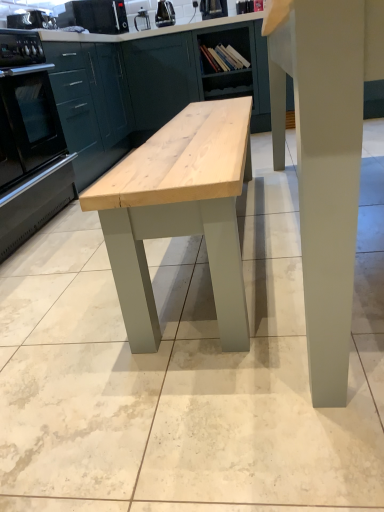
In order to click on matte green cabinetry at left, positioned as the 3th cabinetry in right-to-left order in this screenshot , I will do `click(89, 106)`.

I want to click on wooden bookshelf at center, arranged as the third cabinetry when viewed from the left, so click(228, 63).

This screenshot has height=512, width=384. I want to click on black plastic toaster at upper left, which appears as the 2th appliance when viewed from the left, so click(99, 15).

Consider the image. What is the approximate height of satin black oven at left?

It is 30.28 inches.

Find the location of a particular element. This screenshot has height=512, width=384. satin black oven at left is located at coordinates (29, 142).

Find the location of a particular element. smooth gray table at center is located at coordinates (325, 158).

How much distance is there between black plastic kettle at upper center, the 2th appliance positioned from the right, and wooden bookshelf at center, arranged as the third cabinetry when viewed from the left?

black plastic kettle at upper center, the 2th appliance positioned from the right, and wooden bookshelf at center, arranged as the third cabinetry when viewed from the left, are 29.68 inches apart.

Is black plastic kettle at upper center, positioned as the 3th appliance in left-to-right order, positioned with its back to wooden bookshelf at center, placed as the 1th cabinetry when sorted from right to left?

black plastic kettle at upper center, positioned as the 3th appliance in left-to-right order, does not have its back to wooden bookshelf at center, placed as the 1th cabinetry when sorted from right to left.

From the image's perspective, between black plastic kettle at upper center, the 2th appliance positioned from the right, and wooden bookshelf at center, arranged as the third cabinetry when viewed from the left, which one is located above?

black plastic kettle at upper center, the 2th appliance positioned from the right, appears higher in the image.

Can you confirm if black plastic kettle at upper center, positioned as the 3th appliance in left-to-right order, is thinner than wooden bookshelf at center, arranged as the third cabinetry when viewed from the left?

Yes, black plastic kettle at upper center, positioned as the 3th appliance in left-to-right order, is thinner than wooden bookshelf at center, arranged as the third cabinetry when viewed from the left.

Looking at this image, is matte green cabinetry at left, positioned as the 3th cabinetry in right-to-left order, taller than metallic silver toaster at upper center, marked as the 4th appliance in a left-to-right arrangement?

Yes.

Is matte green cabinetry at left, positioned as the 3th cabinetry in right-to-left order, thinner than metallic silver toaster at upper center, marked as the 4th appliance in a left-to-right arrangement?

In fact, matte green cabinetry at left, positioned as the 3th cabinetry in right-to-left order, might be wider than metallic silver toaster at upper center, marked as the 4th appliance in a left-to-right arrangement.

Is the position of matte green cabinetry at left, positioned as the 3th cabinetry in right-to-left order, more distant than that of metallic silver toaster at upper center, marked as the 4th appliance in a left-to-right arrangement?

No, matte green cabinetry at left, positioned as the 3th cabinetry in right-to-left order, is in front of metallic silver toaster at upper center, marked as the 4th appliance in a left-to-right arrangement.

Is matte green cabinetry at left, marked as the first cabinetry in a left-to-right arrangement, to the left or to the right of metallic silver toaster at upper center, marked as the 4th appliance in a left-to-right arrangement, in the image?

From the image, it's evident that matte green cabinetry at left, marked as the first cabinetry in a left-to-right arrangement, is to the left of metallic silver toaster at upper center, marked as the 4th appliance in a left-to-right arrangement.

Based on the photo, is black plastic kettle at upper center, positioned as the 3th appliance in left-to-right order, taller or shorter than smooth gray table at center?

black plastic kettle at upper center, positioned as the 3th appliance in left-to-right order, is shorter than smooth gray table at center.

In the scene shown: Is black plastic kettle at upper center, positioned as the 3th appliance in left-to-right order, thinner than smooth gray table at center?

Yes, black plastic kettle at upper center, positioned as the 3th appliance in left-to-right order, is thinner than smooth gray table at center.

From the image's perspective, is black plastic kettle at upper center, positioned as the 3th appliance in left-to-right order, over smooth gray table at center?

Indeed, from the image's perspective, black plastic kettle at upper center, positioned as the 3th appliance in left-to-right order, is shown above smooth gray table at center.

Which is farther from the camera, (167, 17) or (360, 160)?

Positioned behind is point (167, 17).

Which object is wider, metallic silver toaster at upper center, marked as the 4th appliance in a left-to-right arrangement, or black plastic toaster at upper left, positioned as the 4th appliance in right-to-left order?

With larger width is black plastic toaster at upper left, positioned as the 4th appliance in right-to-left order.

Between metallic silver toaster at upper center, the 1th appliance positioned from the right, and black plastic toaster at upper left, which ranks as the first appliance in left-to-right order, which one has smaller size?

Smaller between the two is metallic silver toaster at upper center, the 1th appliance positioned from the right.

Is black plastic toaster at upper left, which ranks as the first appliance in left-to-right order, a part of metallic silver toaster at upper center, the 1th appliance positioned from the right?

No, black plastic toaster at upper left, which ranks as the first appliance in left-to-right order, is not surrounded by metallic silver toaster at upper center, the 1th appliance positioned from the right.

From a real-world perspective, which object stands above the other?

black plastic toaster at upper left, positioned as the 4th appliance in right-to-left order, is physically above.

In the image, is satin black oven at left positioned in front of or behind black plastic toaster at upper left, which appears as the 2th appliance when viewed from the left?

satin black oven at left is in front of black plastic toaster at upper left, which appears as the 2th appliance when viewed from the left.

Between satin black oven at left and black plastic toaster at upper left, the third appliance in the right-to-left sequence, which one has more height?

With more height is satin black oven at left.

Is black plastic toaster at upper left, which appears as the 2th appliance when viewed from the left, not near black plastic toaster at upper left, which ranks as the first appliance in left-to-right order?

That's not correct — black plastic toaster at upper left, which appears as the 2th appliance when viewed from the left, is a little close to black plastic toaster at upper left, which ranks as the first appliance in left-to-right order.

Does black plastic toaster at upper left, the third appliance in the right-to-left sequence, turn towards black plastic toaster at upper left, positioned as the 4th appliance in right-to-left order?

No, black plastic toaster at upper left, the third appliance in the right-to-left sequence, does not turn towards black plastic toaster at upper left, positioned as the 4th appliance in right-to-left order.

From the image's perspective, starting from the black plastic toaster at upper left, which ranks as the first appliance in left-to-right order, which appliance is the 2nd one above? Please provide its 2D coordinates.

[(99, 15)]

Is black plastic toaster at upper left, which appears as the 2th appliance when viewed from the left, to the left or to the right of wooden bookshelf at center, arranged as the third cabinetry when viewed from the left, in the image?

black plastic toaster at upper left, which appears as the 2th appliance when viewed from the left, is positioned on wooden bookshelf at center, arranged as the third cabinetry when viewed from the left,'s left side.

Considering the sizes of objects black plastic toaster at upper left, which appears as the 2th appliance when viewed from the left, and wooden bookshelf at center, placed as the 1th cabinetry when sorted from right to left, in the image provided, who is smaller, black plastic toaster at upper left, which appears as the 2th appliance when viewed from the left, or wooden bookshelf at center, placed as the 1th cabinetry when sorted from right to left,?

black plastic toaster at upper left, which appears as the 2th appliance when viewed from the left, is smaller.

From the picture: Is black plastic toaster at upper left, the third appliance in the right-to-left sequence, taller than wooden bookshelf at center, arranged as the third cabinetry when viewed from the left?

In fact, black plastic toaster at upper left, the third appliance in the right-to-left sequence, may be shorter than wooden bookshelf at center, arranged as the third cabinetry when viewed from the left.

From the black plastic kettle at upper center, the 2th appliance positioned from the right, count 2nd cabinetry to the right and point to it. Please provide its 2D coordinates.

[(228, 63)]

This screenshot has height=512, width=384. I want to click on cabinetry that is the 1st one below the metallic silver toaster at upper center, marked as the 4th appliance in a left-to-right arrangement (from a real-world perspective), so click(x=89, y=106).

Based on their spatial positions, is matte green cabinetry at left, positioned as the 3th cabinetry in right-to-left order, or black plastic toaster at upper left, the third appliance in the right-to-left sequence, further from black plastic kettle at upper center, positioned as the 3th appliance in left-to-right order?

matte green cabinetry at left, positioned as the 3th cabinetry in right-to-left order.

From the image, which object appears to be farther from metallic silver toaster at upper center, the 1th appliance positioned from the right, smooth gray table at center or matte green cabinetry at left, marked as the first cabinetry in a left-to-right arrangement?

smooth gray table at center is positioned further to the anchor metallic silver toaster at upper center, the 1th appliance positioned from the right.

Estimate the real-world distances between objects in this image. Which object is further from black plastic toaster at upper left, positioned as the 4th appliance in right-to-left order, matte green cabinet at center, which is the 2th cabinetry in right-to-left order, or wooden bookshelf at center, arranged as the third cabinetry when viewed from the left?

wooden bookshelf at center, arranged as the third cabinetry when viewed from the left, is further to black plastic toaster at upper left, positioned as the 4th appliance in right-to-left order.

Which object lies further to the anchor point matte green cabinetry at left, positioned as the 3th cabinetry in right-to-left order, black plastic kettle at upper center, positioned as the 3th appliance in left-to-right order, or black plastic toaster at upper left, the third appliance in the right-to-left sequence?

black plastic kettle at upper center, positioned as the 3th appliance in left-to-right order, lies further to matte green cabinetry at left, positioned as the 3th cabinetry in right-to-left order, than the other object.

Looking at the image, which one is located further to satin black oven at left, matte green cabinetry at left, marked as the first cabinetry in a left-to-right arrangement, or black plastic kettle at upper center, positioned as the 3th appliance in left-to-right order?

The object further to satin black oven at left is black plastic kettle at upper center, positioned as the 3th appliance in left-to-right order.

Based on the photo, estimate the real-world distances between objects in this image. Which object is further from matte green cabinetry at left, marked as the first cabinetry in a left-to-right arrangement, black plastic toaster at upper left, the third appliance in the right-to-left sequence, or metallic silver toaster at upper center, the 1th appliance positioned from the right?

metallic silver toaster at upper center, the 1th appliance positioned from the right, is further to matte green cabinetry at left, marked as the first cabinetry in a left-to-right arrangement.

Which object lies nearer to the anchor point matte green cabinetry at left, positioned as the 3th cabinetry in right-to-left order, wooden bookshelf at center, placed as the 1th cabinetry when sorted from right to left, or satin black oven at left?

Among the two, satin black oven at left is located nearer to matte green cabinetry at left, positioned as the 3th cabinetry in right-to-left order.

Considering their positions, is matte green cabinet at center, which is the 2th cabinetry in right-to-left order, positioned further to satin black oven at left than black plastic toaster at upper left, the third appliance in the right-to-left sequence?

Among the two, matte green cabinet at center, which is the 2th cabinetry in right-to-left order, is located further to satin black oven at left.

The image size is (384, 512). Identify the location of cabinetry situated between black plastic toaster at upper left, the third appliance in the right-to-left sequence, and metallic silver toaster at upper center, marked as the 4th appliance in a left-to-right arrangement, from left to right. (159, 80).

Locate an element on the screen. This screenshot has width=384, height=512. appliance between black plastic toaster at upper left, which appears as the 2th appliance when viewed from the left, and matte green cabinet at center, which ranks as the 2th cabinetry in left-to-right order is located at coordinates (165, 14).

Image resolution: width=384 pixels, height=512 pixels. I want to click on oven positioned between smooth gray table at center and wooden bookshelf at center, placed as the 1th cabinetry when sorted from right to left, from near to far, so click(x=29, y=142).

Locate an element on the screen. The height and width of the screenshot is (512, 384). appliance between black plastic kettle at upper center, the 2th appliance positioned from the right, and wooden bookshelf at center, arranged as the third cabinetry when viewed from the left, from left to right is located at coordinates (213, 8).